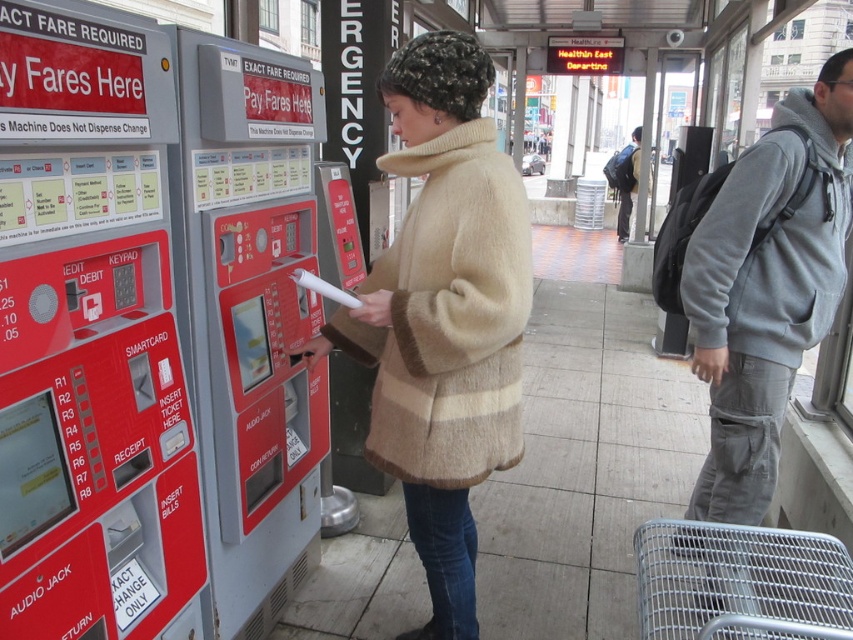
Question: Which point appears closest to the camera in this image?

Choices:
 (A) (621, 234)
 (B) (750, 392)

Answer: (B)

Question: Among these objects, which one is farthest from the camera?

Choices:
 (A) beige fuzzy coat at center
 (B) gray fleece hoodie at right
 (C) dark gray backpack at right

Answer: (C)

Question: Does beige fuzzy coat at center have a larger size compared to gray fleece hoodie at right?

Choices:
 (A) no
 (B) yes

Answer: (A)

Question: Can you confirm if red plastic vending machine at center is positioned above gray fleece hoodie at right?

Choices:
 (A) yes
 (B) no

Answer: (B)

Question: Which of the following is the farthest from the observer?

Choices:
 (A) dark gray backpack at right
 (B) red plastic vending machine at left
 (C) gray fleece hoodie at right

Answer: (A)

Question: Does red plastic vending machine at left lie behind gray fleece hoodie at right?

Choices:
 (A) no
 (B) yes

Answer: (A)